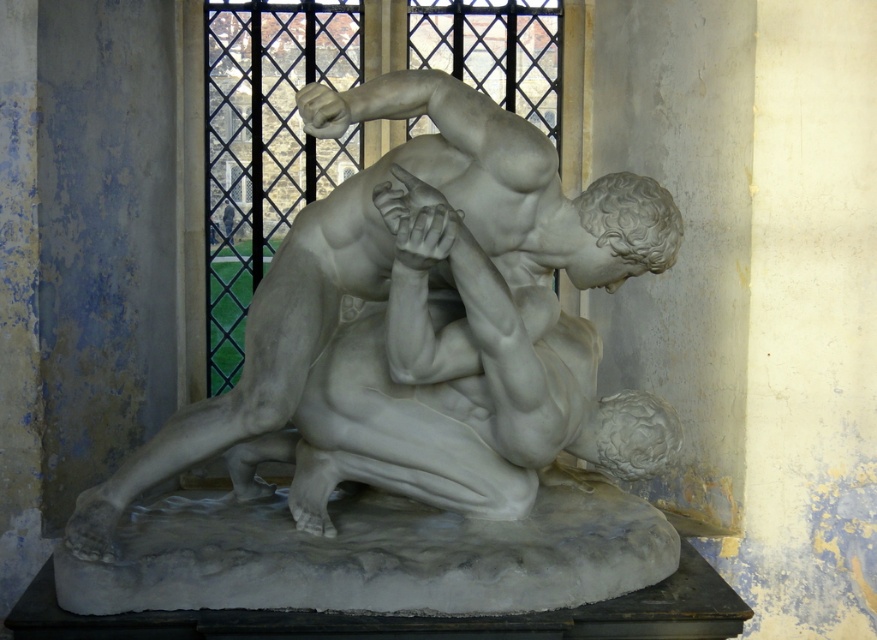
Based on the photo, you are standing in front of the sculpture and want to determine the spatial relationship between the two points. Which point is closer to you, point [257,528] or point [232,365]?

Point [257,528] is in front of point [232,365], so it is closer to you.

You are an art conservator who needs to move the white marble statue at center closer to the clear glass window at center. The minimum distance required between the statue and the window for proper preservation is 4 meters. Can you move the statue to meet this requirement?

The white marble statue at center is currently 4.15 meters away from the clear glass window at center. Since the required minimum distance is 4 meters, moving it closer by 0.15 meters would still meet the preservation requirement.

You are an art conservator examining the white marble statue at center and the clear glass window at center. Based on the scene, which object is more likely to be exposed to direct sunlight? Please explain your reasoning.

The clear glass window at center is more likely to be exposed to direct sunlight because it is positioned above the white marble statue at center, allowing sunlight to pass through it and potentially illuminate the statue below.